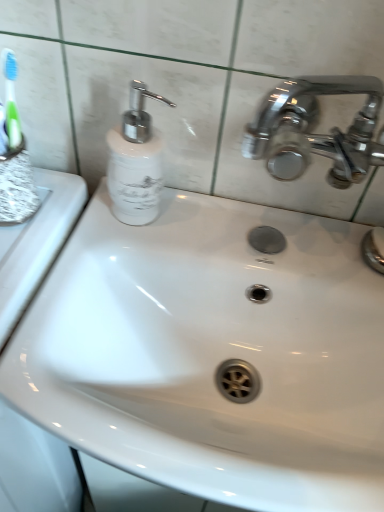
Where is `vacant area that lies between polished chrome faucet at upper right and white glossy soap dispenser at upper left`? The image size is (384, 512). vacant area that lies between polished chrome faucet at upper right and white glossy soap dispenser at upper left is located at coordinates (264, 231).